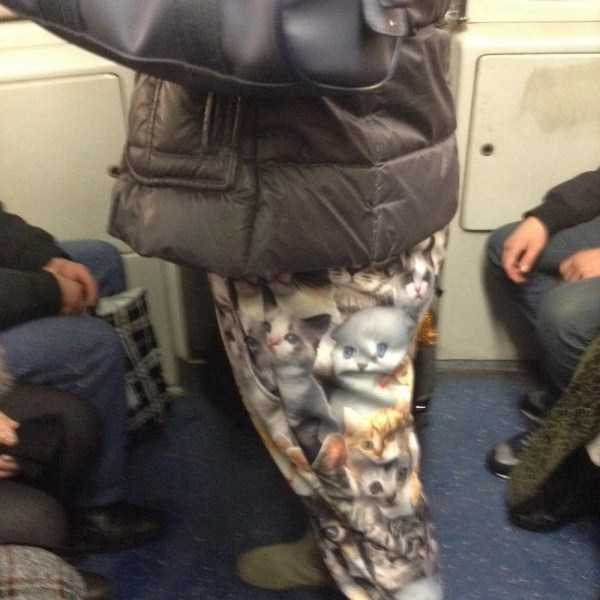
What are the coordinates of `door` in the screenshot? It's located at [494, 126], [71, 154].